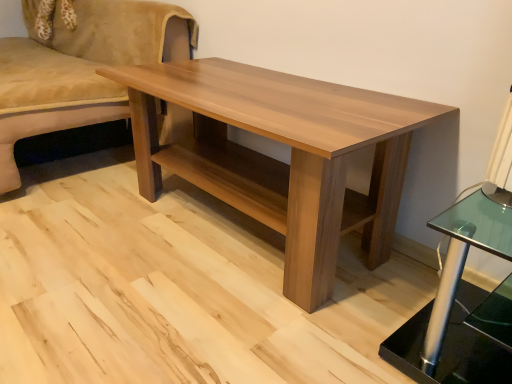
Question: Is suede beige studio couch at upper left next to light brown wood coffee table at center?

Choices:
 (A) yes
 (B) no

Answer: (B)

Question: Does suede beige studio couch at upper left turn towards light brown wood coffee table at center?

Choices:
 (A) no
 (B) yes

Answer: (A)

Question: Does suede beige studio couch at upper left lie behind light brown wood coffee table at center?

Choices:
 (A) no
 (B) yes

Answer: (B)

Question: Are suede beige studio couch at upper left and light brown wood coffee table at center far apart?

Choices:
 (A) no
 (B) yes

Answer: (A)

Question: Is suede beige studio couch at upper left wider than light brown wood coffee table at center?

Choices:
 (A) no
 (B) yes

Answer: (B)

Question: Is suede beige studio couch at upper left located outside light brown wood coffee table at center?

Choices:
 (A) yes
 (B) no

Answer: (A)

Question: Is light brown wood coffee table at center at the left side of suede beige studio couch at upper left?

Choices:
 (A) yes
 (B) no

Answer: (B)

Question: Could you tell me if light brown wood coffee table at center is facing suede beige studio couch at upper left?

Choices:
 (A) yes
 (B) no

Answer: (B)

Question: Is light brown wood coffee table at center closer to the viewer compared to suede beige studio couch at upper left?

Choices:
 (A) no
 (B) yes

Answer: (B)

Question: Is light brown wood coffee table at center to the right of suede beige studio couch at upper left from the viewer's perspective?

Choices:
 (A) yes
 (B) no

Answer: (A)

Question: Considering the relative sizes of light brown wood coffee table at center and suede beige studio couch at upper left in the image provided, is light brown wood coffee table at center taller than suede beige studio couch at upper left?

Choices:
 (A) yes
 (B) no

Answer: (B)

Question: Is there a large distance between light brown wood coffee table at center and suede beige studio couch at upper left?

Choices:
 (A) yes
 (B) no

Answer: (B)

Question: Is suede beige studio couch at upper left in front of or behind light brown wood coffee table at center in the image?

Choices:
 (A) front
 (B) behind

Answer: (B)